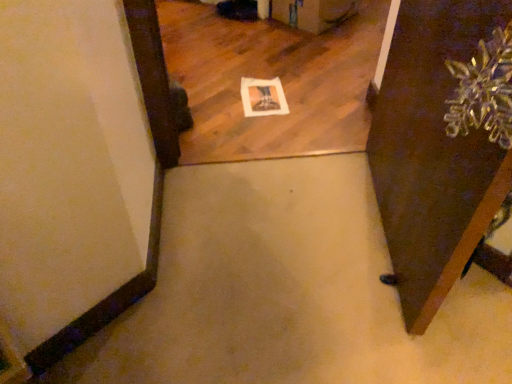
Locate an element on the screen. This screenshot has width=512, height=384. free spot to the left of brown wooden door at lower right is located at coordinates (x=268, y=238).